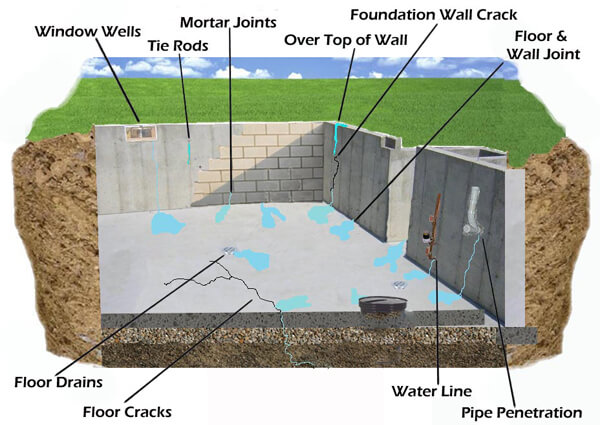
At what (x,y) coordinates should I click in order to perform the action: click on wall. Please return your answer as a coordinate pair (x, y). Looking at the image, I should click on (524, 54).